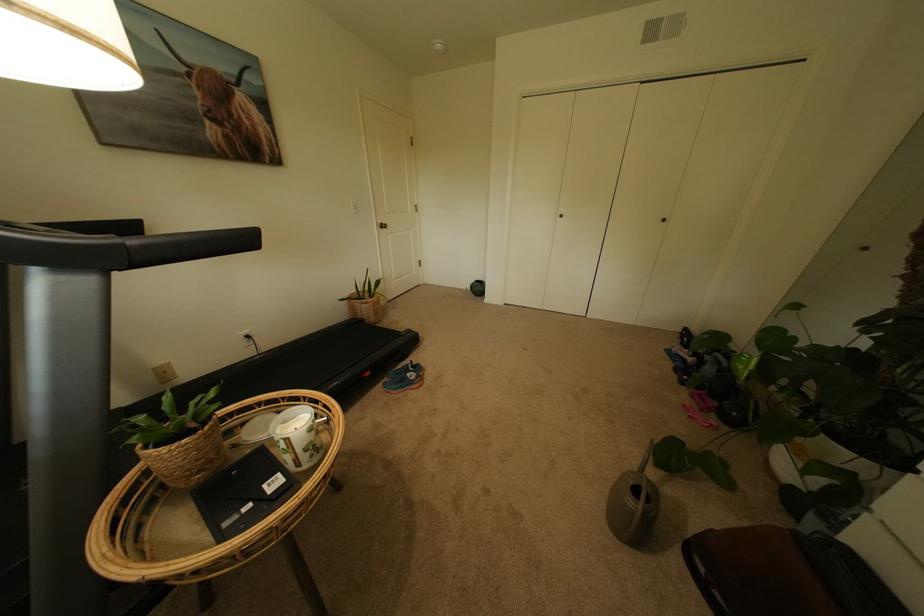
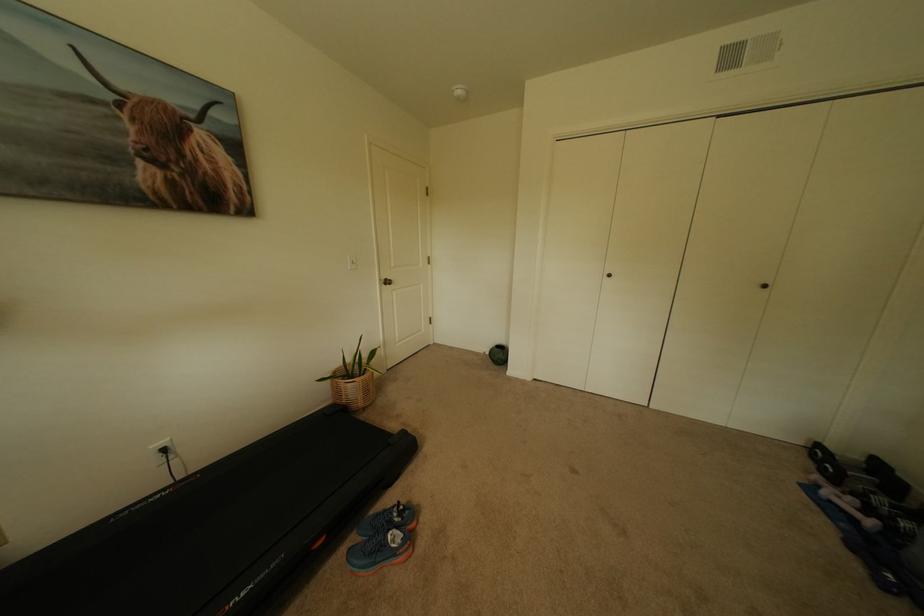
Question: What movement of the cameraman would produce the second image?

Choices:
 (A) Left
 (B) Right
 (C) Forward
 (D) Backward

Answer: (C)